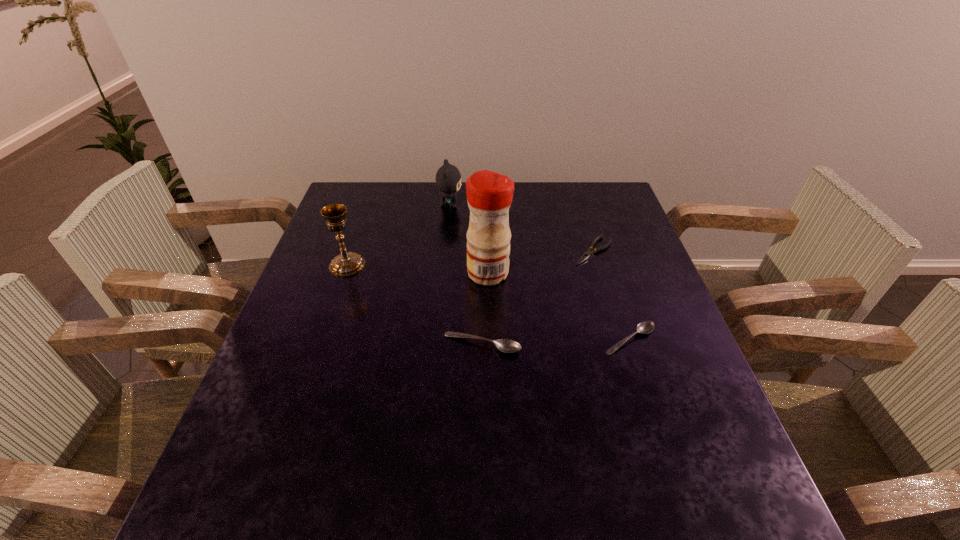
The width and height of the screenshot is (960, 540). What are the coordinates of `the taller soupspoon` in the screenshot? It's located at (504, 345).

Find the location of a particular element. The width and height of the screenshot is (960, 540). the left soupspoon is located at coordinates (504, 345).

The image size is (960, 540). Identify the location of the shorter soupspoon. (645, 327).

Identify the location of kitten. (448, 178).

I want to click on the fourth shortest object, so point(448,178).

Where is `pliers`? This screenshot has height=540, width=960. pliers is located at coordinates (589, 252).

Where is `condiment`? condiment is located at coordinates (489, 194).

Identify the location of the fifth shortest object. (347, 263).

I want to click on chalice, so click(347, 263).

Where is `free space located on the right of the third shortest object`? Image resolution: width=960 pixels, height=540 pixels. free space located on the right of the third shortest object is located at coordinates (623, 344).